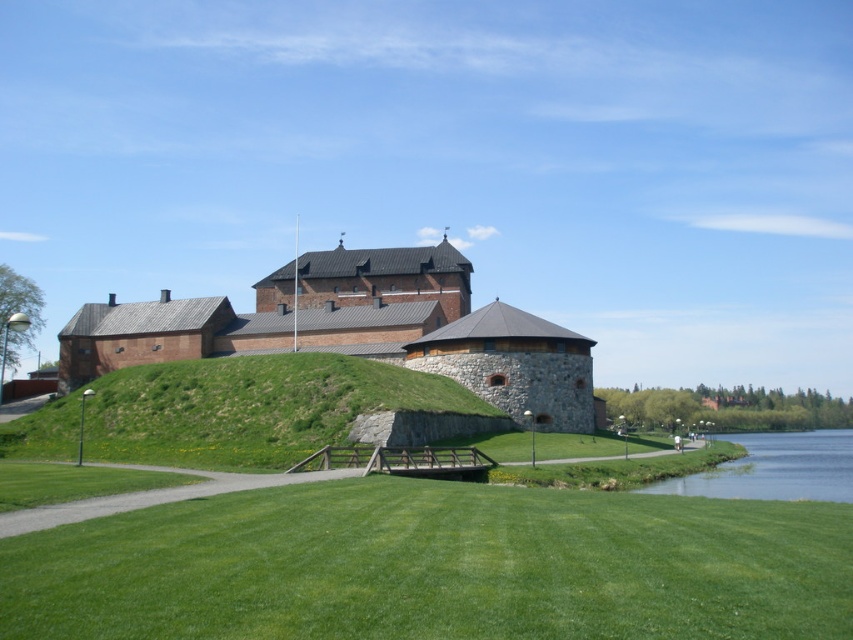
Question: Which point is farther to the camera?

Choices:
 (A) (570, 413)
 (B) (256, 467)

Answer: (A)

Question: Which point appears closest to the camera in this image?

Choices:
 (A) [x=90, y=307]
 (B) [x=276, y=392]
 (C) [x=231, y=627]

Answer: (C)

Question: Is green grass at lower center to the right of brown stone castle at center from the viewer's perspective?

Choices:
 (A) no
 (B) yes

Answer: (B)

Question: Does green grass at lower center come in front of green grassy hillside at center?

Choices:
 (A) no
 (B) yes

Answer: (B)

Question: Is green grass at lower center behind green grassy hillside at center?

Choices:
 (A) no
 (B) yes

Answer: (A)

Question: Estimate the real-world distances between objects in this image. Which object is farther from the green grassy hillside at center?

Choices:
 (A) green grass at lower center
 (B) brown stone castle at center

Answer: (B)